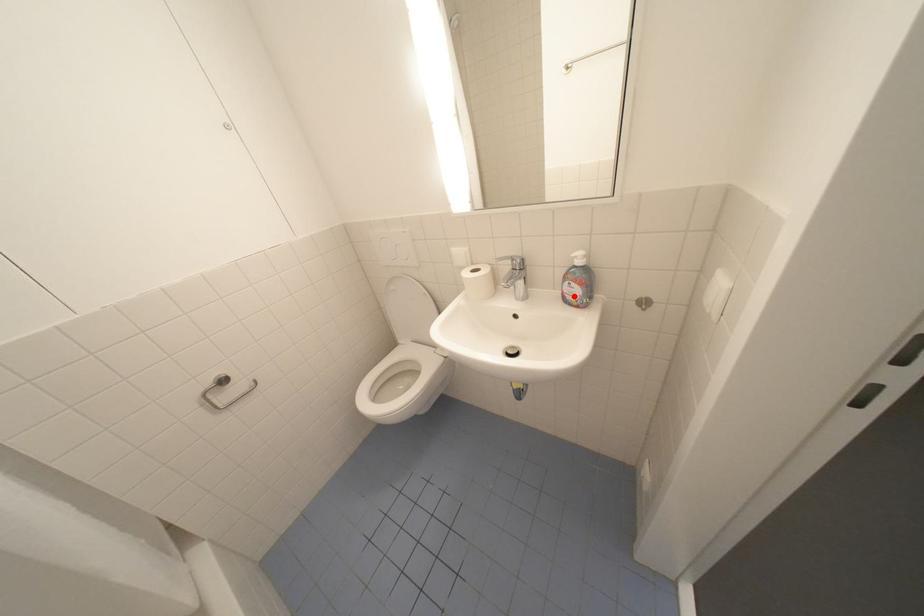
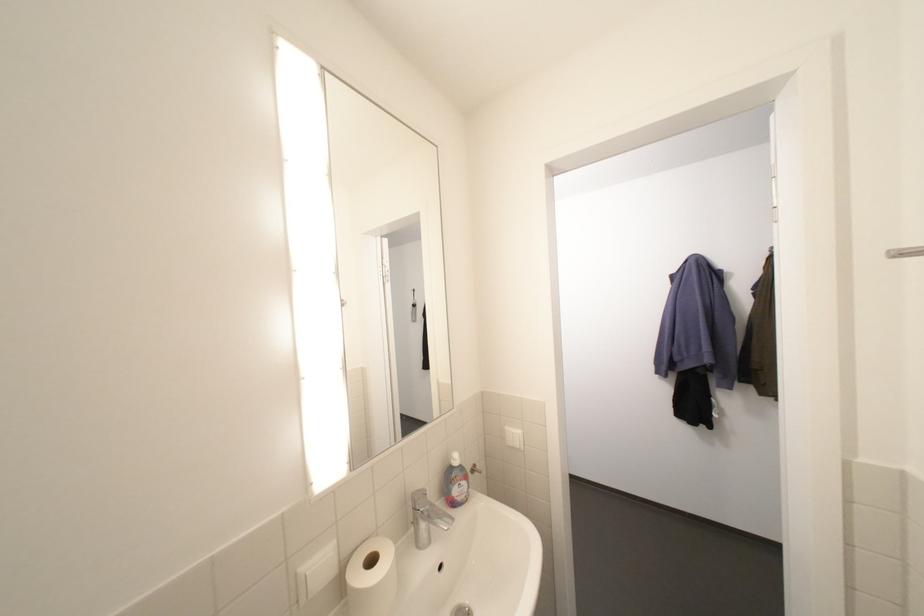
In the second image, find the point that corresponds to the highlighted location in the first image.

(465, 499)